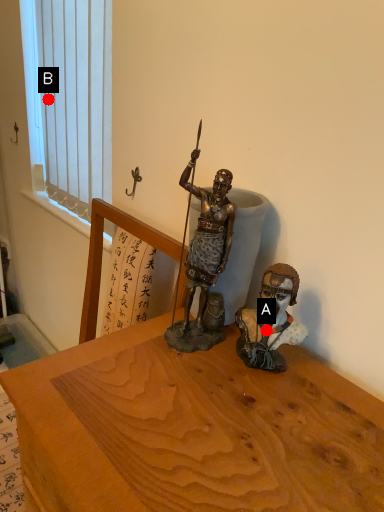
Question: Two points are circled on the image, labeled by A and B beside each circle. Which of the following is the closest to the observer?

Choices:
 (A) A is closer
 (B) B is closer

Answer: (A)